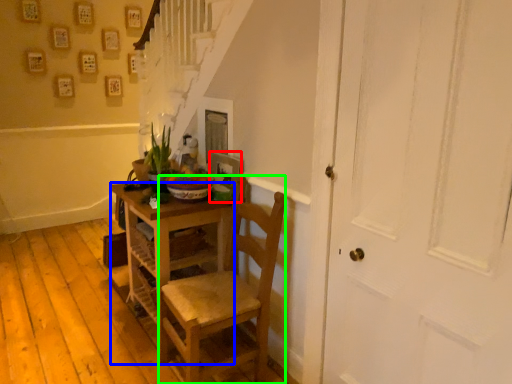
Question: Which object is positioned farthest from picture frame (highlighted by a red box)? Select from desk (highlighted by a blue box) and chair (highlighted by a green box).

Choices:
 (A) desk
 (B) chair

Answer: (B)